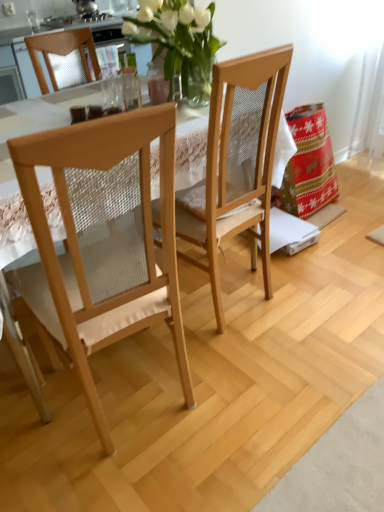
Find the location of a particular element. This screenshot has width=384, height=512. light wood/mesh chair at left, which is the 1th chair from left to right is located at coordinates (100, 244).

What do you see at coordinates (100, 244) in the screenshot? This screenshot has width=384, height=512. I see `light wood/mesh chair at left, the 2th chair when ordered from right to left` at bounding box center [100, 244].

What do you see at coordinates (238, 160) in the screenshot? I see `light brown wood chair at center, which is the 2th chair from left to right` at bounding box center [238, 160].

Locate an element on the screen. light brown wood chair at center, which is the 2th chair from left to right is located at coordinates (238, 160).

This screenshot has width=384, height=512. I want to click on light wood/mesh chair at left, the 2th chair when ordered from right to left, so click(x=100, y=244).

Which is more to the right, light brown wood chair at center, acting as the 1th chair starting from the right, or light wood/mesh chair at left, which is the 1th chair from left to right?

light brown wood chair at center, acting as the 1th chair starting from the right.

Is the position of light brown wood chair at center, acting as the 1th chair starting from the right, less distant than that of light wood/mesh chair at left, which is the 1th chair from left to right?

No, it is behind light wood/mesh chair at left, which is the 1th chair from left to right.

Considering the points (210, 173) and (56, 306), which point is in front, point (210, 173) or point (56, 306)?

The point (56, 306) is closer to the camera.

From the image's perspective, is light brown wood chair at center, which is the 2th chair from left to right, positioned above or below light wood/mesh chair at left, the 2th chair when ordered from right to left?

light brown wood chair at center, which is the 2th chair from left to right, is above light wood/mesh chair at left, the 2th chair when ordered from right to left.

From a real-world perspective, which object rests below the other?

In real-world perspective, light wood/mesh chair at left, which is the 1th chair from left to right, is lower.

Between light brown wood chair at center, acting as the 1th chair starting from the right, and light wood/mesh chair at left, the 2th chair when ordered from right to left, which one has smaller width?

light brown wood chair at center, acting as the 1th chair starting from the right, is thinner.

Which of these two, light brown wood chair at center, which is the 2th chair from left to right, or light wood/mesh chair at left, the 2th chair when ordered from right to left, stands taller?

With more height is light brown wood chair at center, which is the 2th chair from left to right.

Based on the photo, is light brown wood chair at center, acting as the 1th chair starting from the right, smaller than light wood/mesh chair at left, the 2th chair when ordered from right to left?

Yes, light brown wood chair at center, acting as the 1th chair starting from the right, is smaller than light wood/mesh chair at left, the 2th chair when ordered from right to left.

Is light brown wood chair at center, acting as the 1th chair starting from the right, surrounding light wood/mesh chair at left, which is the 1th chair from left to right?

No, light wood/mesh chair at left, which is the 1th chair from left to right, is not surrounded by light brown wood chair at center, acting as the 1th chair starting from the right.

Are light brown wood chair at center, which is the 2th chair from left to right, and light wood/mesh chair at left, the 2th chair when ordered from right to left, far apart?

No.

Is light brown wood chair at center, acting as the 1th chair starting from the right, positioned with its back to light wood/mesh chair at left, which is the 1th chair from left to right?

No.

How distant is light brown wood chair at center, which is the 2th chair from left to right, from light wood/mesh chair at left, the 2th chair when ordered from right to left?

light brown wood chair at center, which is the 2th chair from left to right, and light wood/mesh chair at left, the 2th chair when ordered from right to left, are 19.86 inches apart.

This screenshot has width=384, height=512. Find the location of `chair above the light wood/mesh chair at left, the 2th chair when ordered from right to left (from a real-world perspective)`. chair above the light wood/mesh chair at left, the 2th chair when ordered from right to left (from a real-world perspective) is located at coordinates (238, 160).

Between light wood/mesh chair at left, which is the 1th chair from left to right, and light brown wood chair at center, which is the 2th chair from left to right, which one appears on the left side from the viewer's perspective?

light wood/mesh chair at left, which is the 1th chair from left to right, is more to the left.

Considering the relative positions of light wood/mesh chair at left, the 2th chair when ordered from right to left, and light brown wood chair at center, which is the 2th chair from left to right, in the image provided, is light wood/mesh chair at left, the 2th chair when ordered from right to left, in front of light brown wood chair at center, which is the 2th chair from left to right,?

Yes, the depth of light wood/mesh chair at left, the 2th chair when ordered from right to left, is less than that of light brown wood chair at center, which is the 2th chair from left to right.

Is point (81, 314) positioned in front of point (265, 81)?

That is True.

From the image's perspective, which one is positioned higher, light wood/mesh chair at left, which is the 1th chair from left to right, or light brown wood chair at center, acting as the 1th chair starting from the right?

light brown wood chair at center, acting as the 1th chair starting from the right, is shown above in the image.

From a real-world perspective, is light wood/mesh chair at left, the 2th chair when ordered from right to left, below light brown wood chair at center, which is the 2th chair from left to right?

Yes.

Considering the relative sizes of light wood/mesh chair at left, which is the 1th chair from left to right, and light brown wood chair at center, which is the 2th chair from left to right, in the image provided, is light wood/mesh chair at left, which is the 1th chair from left to right, wider than light brown wood chair at center, which is the 2th chair from left to right,?

Correct, the width of light wood/mesh chair at left, which is the 1th chair from left to right, exceeds that of light brown wood chair at center, which is the 2th chair from left to right.

Does light wood/mesh chair at left, which is the 1th chair from left to right, have a greater height compared to light brown wood chair at center, acting as the 1th chair starting from the right?

Incorrect, the height of light wood/mesh chair at left, which is the 1th chair from left to right, is not larger of that of light brown wood chair at center, acting as the 1th chair starting from the right.

Considering the relative sizes of light wood/mesh chair at left, the 2th chair when ordered from right to left, and light brown wood chair at center, acting as the 1th chair starting from the right, in the image provided, is light wood/mesh chair at left, the 2th chair when ordered from right to left, bigger than light brown wood chair at center, acting as the 1th chair starting from the right,?

Indeed, light wood/mesh chair at left, the 2th chair when ordered from right to left, has a larger size compared to light brown wood chair at center, acting as the 1th chair starting from the right.

Is light wood/mesh chair at left, the 2th chair when ordered from right to left, positioned beyond the bounds of light brown wood chair at center, acting as the 1th chair starting from the right?

That's correct, light wood/mesh chair at left, the 2th chair when ordered from right to left, is outside of light brown wood chair at center, acting as the 1th chair starting from the right.

Looking at this image, is light wood/mesh chair at left, which is the 1th chair from left to right, far from light brown wood chair at center, which is the 2th chair from left to right?

They are positioned close to each other.

Is light wood/mesh chair at left, which is the 1th chair from left to right, turned away from light brown wood chair at center, which is the 2th chair from left to right?

No, light wood/mesh chair at left, which is the 1th chair from left to right, is not facing the opposite direction of light brown wood chair at center, which is the 2th chair from left to right.

Can you tell me how much light wood/mesh chair at left, which is the 1th chair from left to right, and light brown wood chair at center, which is the 2th chair from left to right, differ in facing direction?

10.1 degrees.

Find the location of a particular element. The image size is (384, 512). chair above the light wood/mesh chair at left, the 2th chair when ordered from right to left (from the image's perspective) is located at coordinates (238, 160).

Identify the location of chair in front of the light brown wood chair at center, which is the 2th chair from left to right. (100, 244).

Where is `chair below the light brown wood chair at center, acting as the 1th chair starting from the right (from a real-world perspective)`? The image size is (384, 512). chair below the light brown wood chair at center, acting as the 1th chair starting from the right (from a real-world perspective) is located at coordinates (100, 244).